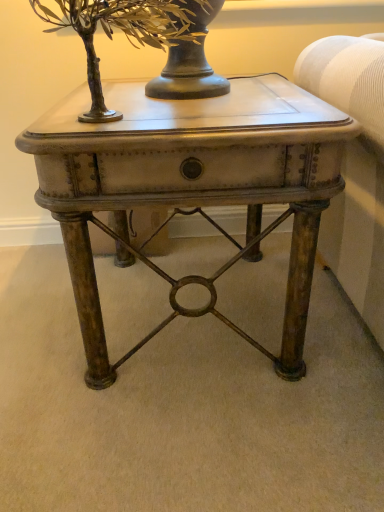
Where is `free space behind green metallic tree at upper center`? free space behind green metallic tree at upper center is located at coordinates 126,94.